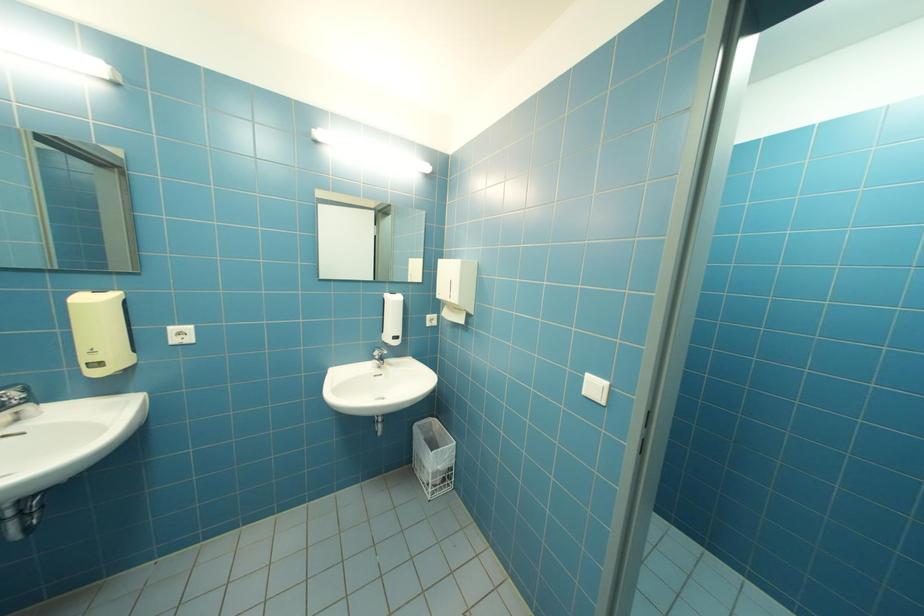
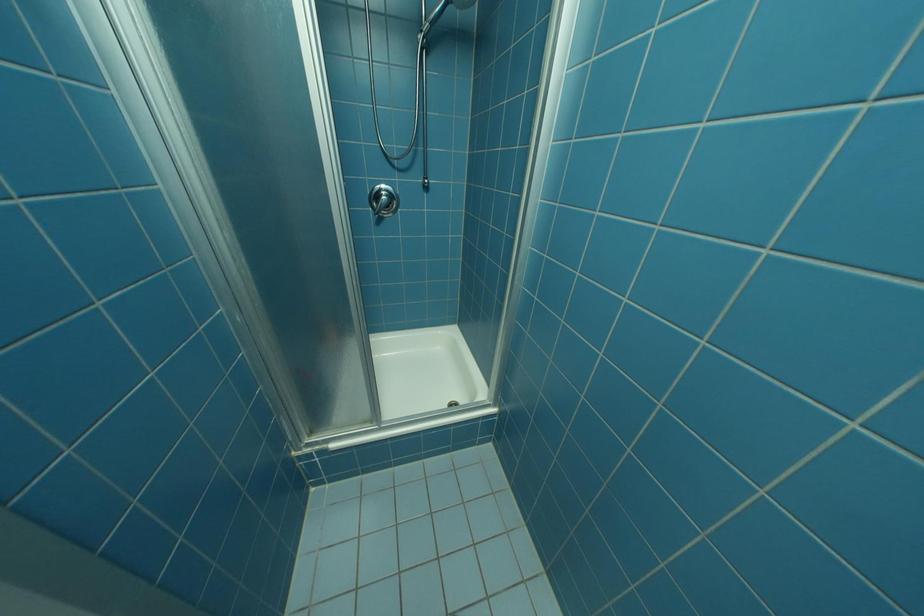
The images are taken continuously from a first-person perspective. In which direction are you moving?

The movement direction of the cameraman is right, forward.